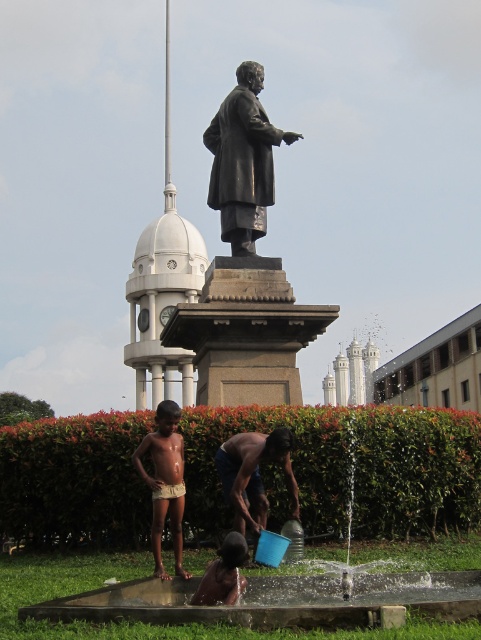
Who is more forward, (240, 186) or (166, 129)?

Point (240, 186)

Find the location of `bronze statue at center`. bronze statue at center is located at coordinates (242, 161).

Who is lower down, bronze statue at center or light brown skin at center?

light brown skin at center is lower down.

Can you confirm if bronze statue at center is shorter than light brown skin at center?

No.

The image size is (481, 640). Describe the element at coordinates (242, 161) in the screenshot. I see `bronze statue at center` at that location.

Where is `bronze statue at center`? The width and height of the screenshot is (481, 640). bronze statue at center is located at coordinates pyautogui.click(x=242, y=161).

Does dark skin human at lower center come in front of white glossy flag pole at upper center?

Yes, dark skin human at lower center is in front of white glossy flag pole at upper center.

Which of these two, dark skin human at lower center or white glossy flag pole at upper center, stands shorter?

With less height is dark skin human at lower center.

Find the location of a particular element. dark skin human at lower center is located at coordinates (224, 573).